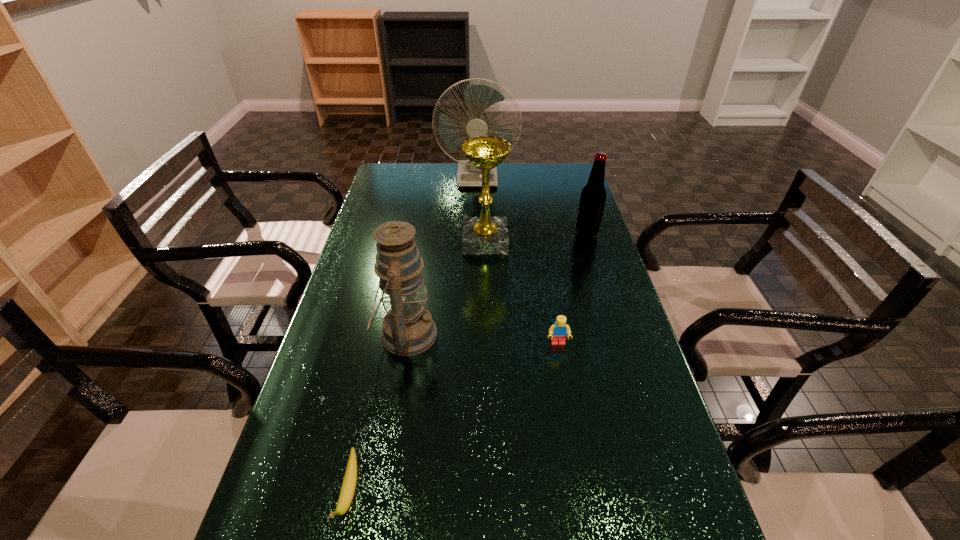
Identify the location of fan. (478, 98).

At what (x,y) coordinates should I click in order to perform the action: click on the farthest object. Please return your answer as a coordinate pair (x, y). Image resolution: width=960 pixels, height=540 pixels. Looking at the image, I should click on (478, 98).

You are a GUI agent. You are given a task and a screenshot of the screen. Output one action in this format:
    pyautogui.click(x=<x>, y=<y>)
    Task: Click on the oil lamp
    The height and width of the screenshot is (540, 960).
    Given the screenshot: What is the action you would take?
    pyautogui.click(x=408, y=329)

The image size is (960, 540). Find the location of `award`. award is located at coordinates (481, 235).

You are a GUI agent. You are given a task and a screenshot of the screen. Output one action in this format:
    pyautogui.click(x=<x>, y=<y>)
    Task: Click on the beer bottle
    The image size is (960, 540).
    Given the screenshot: What is the action you would take?
    pyautogui.click(x=593, y=196)

Image resolution: width=960 pixels, height=540 pixels. I want to click on the rightmost object, so click(x=593, y=196).

This screenshot has height=540, width=960. Identify the location of the fifth tallest object. (558, 332).

Where is `the second object from right to left`? the second object from right to left is located at coordinates (558, 332).

Where is `the shortest object`? The width and height of the screenshot is (960, 540). the shortest object is located at coordinates (347, 492).

The height and width of the screenshot is (540, 960). I want to click on banana, so click(x=347, y=492).